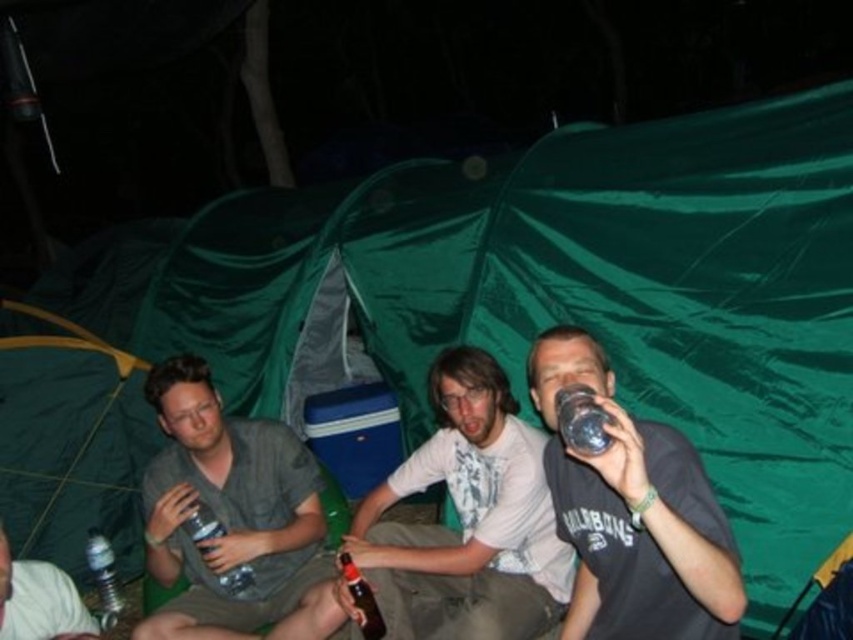
In the scene shown: Who is taller, matte gray shirt at center or brushed metal water bottle at lower left?

With more height is matte gray shirt at center.

Does matte gray shirt at center appear on the left side of brushed metal water bottle at lower left?

No, matte gray shirt at center is not to the left of brushed metal water bottle at lower left.

Does point (422, 605) come farther from viewer compared to point (78, 636)?

Yes.

Where is `matte gray shirt at center`? matte gray shirt at center is located at coordinates (468, 518).

Is point (107, 570) positioned before point (242, 573)?

No, (107, 570) is behind (242, 573).

Can you confirm if clear plastic bottle at lower left is taller than clear plastic bottle at center?

Indeed, clear plastic bottle at lower left has a greater height compared to clear plastic bottle at center.

In order to click on clear plastic bottle at lower left in this screenshot , I will do `click(103, 577)`.

Can you confirm if matte gray shirt at center is wider than clear plastic bottle at lower left?

Indeed, matte gray shirt at center has a greater width compared to clear plastic bottle at lower left.

Can you confirm if matte gray shirt at center is thinner than clear plastic bottle at lower left?

Incorrect, matte gray shirt at center's width is not less than clear plastic bottle at lower left's.

Who is more forward, (515,634) or (99,586)?

Point (515,634) is more forward.

Identify the location of matte gray shirt at center. This screenshot has height=640, width=853. coord(468,518).